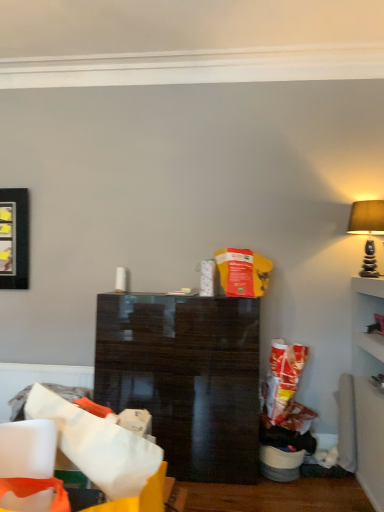
Question: Considering the relative sizes of matte beige lampshade at upper right and glossy dark wood cabinet at center in the image provided, is matte beige lampshade at upper right smaller than glossy dark wood cabinet at center?

Choices:
 (A) no
 (B) yes

Answer: (B)

Question: Does matte beige lampshade at upper right have a greater height compared to glossy dark wood cabinet at center?

Choices:
 (A) yes
 (B) no

Answer: (B)

Question: Considering the relative sizes of matte beige lampshade at upper right and glossy dark wood cabinet at center in the image provided, is matte beige lampshade at upper right wider than glossy dark wood cabinet at center?

Choices:
 (A) no
 (B) yes

Answer: (A)

Question: Is matte beige lampshade at upper right next to glossy dark wood cabinet at center?

Choices:
 (A) no
 (B) yes

Answer: (A)

Question: From a real-world perspective, is matte beige lampshade at upper right below glossy dark wood cabinet at center?

Choices:
 (A) yes
 (B) no

Answer: (B)

Question: In terms of height, does matte beige lampshade at upper right look taller or shorter compared to glossy dark wood cabinet at center?

Choices:
 (A) short
 (B) tall

Answer: (A)

Question: Considering the positions of point (367, 202) and point (190, 345), is point (367, 202) closer or farther from the camera than point (190, 345)?

Choices:
 (A) closer
 (B) farther

Answer: (B)

Question: Is matte beige lampshade at upper right inside the boundaries of glossy dark wood cabinet at center, or outside?

Choices:
 (A) inside
 (B) outside

Answer: (B)

Question: Considering the relative positions of matte beige lampshade at upper right and glossy dark wood cabinet at center in the image provided, is matte beige lampshade at upper right to the left or to the right of glossy dark wood cabinet at center?

Choices:
 (A) right
 (B) left

Answer: (A)

Question: Would you say matte black picture frame at left is to the left or to the right of matte beige lampshade at upper right in the picture?

Choices:
 (A) left
 (B) right

Answer: (A)

Question: In terms of size, does matte black picture frame at left appear bigger or smaller than matte beige lampshade at upper right?

Choices:
 (A) small
 (B) big

Answer: (A)

Question: Does point 8,238 appear closer or farther from the camera than point 372,240?

Choices:
 (A) farther
 (B) closer

Answer: (A)

Question: From a real-world perspective, is matte black picture frame at left positioned above or below matte beige lampshade at upper right?

Choices:
 (A) below
 (B) above

Answer: (A)

Question: From a real-world perspective, is matte beige lampshade at upper right above or below white paper bag at lower left?

Choices:
 (A) above
 (B) below

Answer: (A)

Question: From the image's perspective, is matte beige lampshade at upper right above or below white paper bag at lower left?

Choices:
 (A) below
 (B) above

Answer: (B)